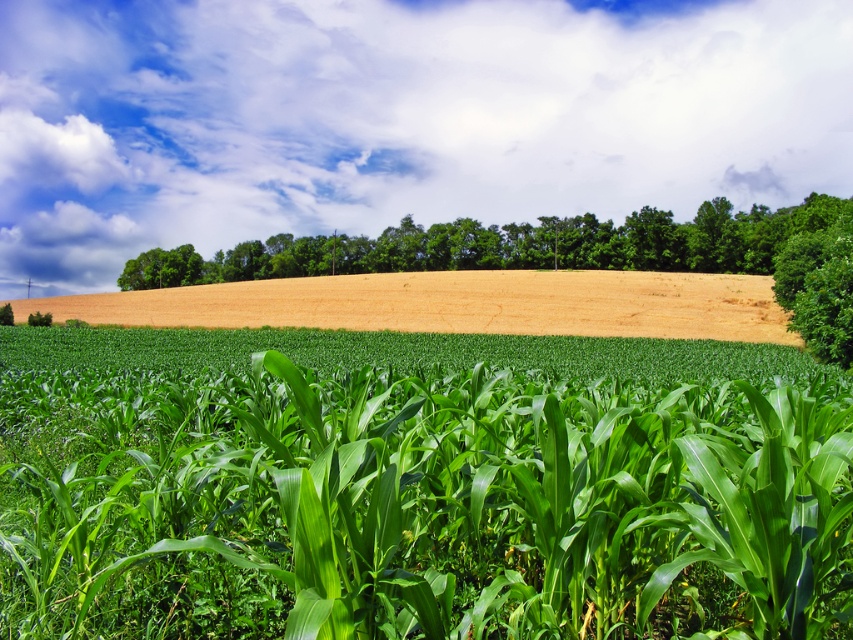
Is point (93, 176) less distant than point (86, 301)?

No, it is behind (86, 301).

Does white fluffy cloud at upper center appear over golden dry wheat field at center?

Yes.

Describe the element at coordinates (396, 118) in the screenshot. The height and width of the screenshot is (640, 853). I see `white fluffy cloud at upper center` at that location.

You are a GUI agent. You are given a task and a screenshot of the screen. Output one action in this format:
    pyautogui.click(x=<x>, y=<y>)
    Task: Click on the white fluffy cloud at upper center
    The width and height of the screenshot is (853, 640).
    Given the screenshot: What is the action you would take?
    pyautogui.click(x=396, y=118)

Can you confirm if green leafy corn at center is positioned to the left of golden dry wheat field at center?

No, green leafy corn at center is not to the left of golden dry wheat field at center.

Is point (529, 518) farther from camera compared to point (53, 300)?

No, (529, 518) is closer to viewer.

Between point (820, 467) and point (264, 288), which one is positioned behind?

Positioned behind is point (264, 288).

Where is `green leafy corn at center`? The image size is (853, 640). green leafy corn at center is located at coordinates (421, 506).

Measure the distance between point (711, 280) and camera.

They are 80.92 meters apart.

This screenshot has width=853, height=640. Find the location of `golden dry wheat field at center`. golden dry wheat field at center is located at coordinates (456, 305).